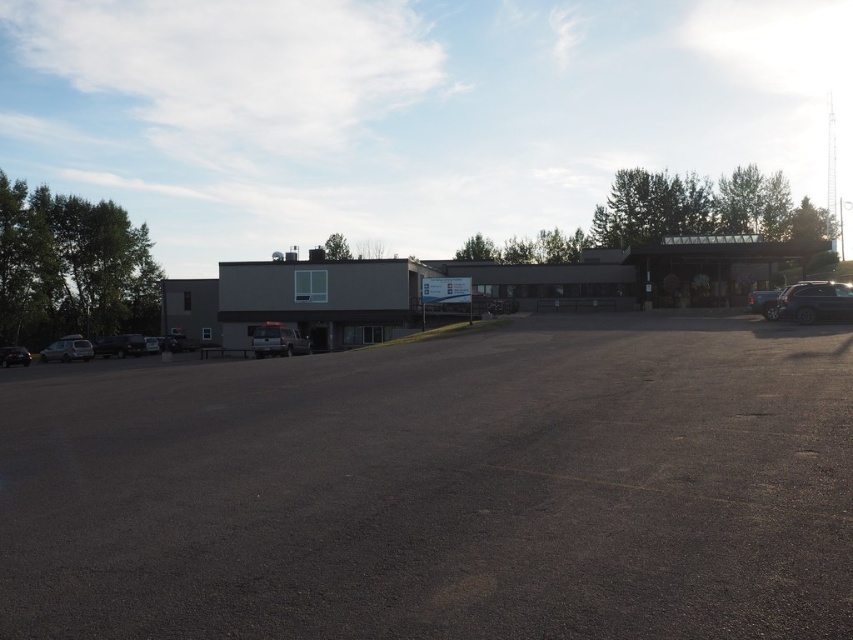
You are a delivery driver arriving at the parking lot in front of the modern building. You need to park your vehicle but notice two sedans already occupying the lower left area. Which sedan, the metallic silver sedan at lower left or the shiny black sedan at lower left, is blocking the other one from moving forward?

The metallic silver sedan at lower left is positioned over shiny black sedan at lower left, meaning it is blocking the shiny black sedan at lower lower from moving forward.

You are a delivery driver arriving at the modern building. You need to park your matte silver suv at left in the dark asphalt parking lot at center. Is the parking lot directly adjacent to the building?

The dark asphalt parking lot at center is to the right of the matte silver suv at left, but the description does not specify the parking lot location relative to the building. Please check the scene description for more details.

You are a delivery driver who needs to park your metallic silver van at center in the dark asphalt parking lot at center. Can you fit your van in the parking space?

The dark asphalt parking lot at center is bigger than the metallic silver van at center, so yes, the metallic silver van at center can fit in the parking space.